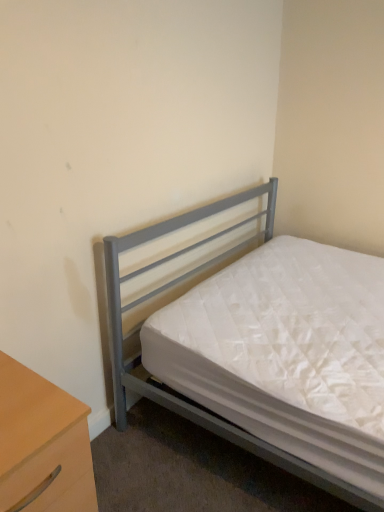
Question: From a real-world perspective, does light wood/wooden nightstand at lower left sit lower than metallic gray bed at center?

Choices:
 (A) yes
 (B) no

Answer: (A)

Question: From the image's perspective, is light wood/wooden nightstand at lower left on metallic gray bed at center?

Choices:
 (A) no
 (B) yes

Answer: (A)

Question: Does light wood/wooden nightstand at lower left turn towards metallic gray bed at center?

Choices:
 (A) yes
 (B) no

Answer: (B)

Question: Is light wood/wooden nightstand at lower left taller than metallic gray bed at center?

Choices:
 (A) no
 (B) yes

Answer: (A)

Question: Does light wood/wooden nightstand at lower left have a lesser height compared to metallic gray bed at center?

Choices:
 (A) yes
 (B) no

Answer: (A)

Question: Would you say light wood/wooden nightstand at lower left is a long distance from metallic gray bed at center?

Choices:
 (A) no
 (B) yes

Answer: (A)

Question: Does metallic gray bed at center have a greater height compared to light wood/wooden nightstand at lower left?

Choices:
 (A) no
 (B) yes

Answer: (B)

Question: Is metallic gray bed at center thinner than light wood/wooden nightstand at lower left?

Choices:
 (A) no
 (B) yes

Answer: (A)

Question: Is metallic gray bed at center further to camera compared to light wood/wooden nightstand at lower left?

Choices:
 (A) no
 (B) yes

Answer: (B)

Question: Would you say metallic gray bed at center is outside light wood/wooden nightstand at lower left?

Choices:
 (A) no
 (B) yes

Answer: (B)

Question: Is metallic gray bed at center shorter than light wood/wooden nightstand at lower left?

Choices:
 (A) no
 (B) yes

Answer: (A)

Question: Is metallic gray bed at center to the right of light wood/wooden nightstand at lower left from the viewer's perspective?

Choices:
 (A) yes
 (B) no

Answer: (A)

Question: In the image, is light wood/wooden nightstand at lower left positioned in front of or behind metallic gray bed at center?

Choices:
 (A) behind
 (B) front

Answer: (B)